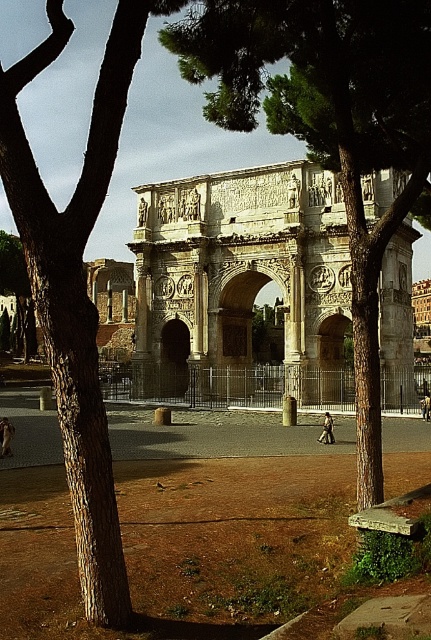
Question: Can you confirm if green leafy tree at center is thinner than brown rough tree at left?

Choices:
 (A) no
 (B) yes

Answer: (B)

Question: Is green leafy tree at center to the left of brown rough tree at left from the viewer's perspective?

Choices:
 (A) no
 (B) yes

Answer: (A)

Question: In this image, where is green leafy tree at center located relative to brown rough tree at left?

Choices:
 (A) below
 (B) above

Answer: (A)

Question: Which point appears farthest from the camera in this image?

Choices:
 (A) (349, 212)
 (B) (88, 458)

Answer: (A)

Question: Which point is closer to the camera?

Choices:
 (A) green leafy tree at center
 (B) brown rough tree at left

Answer: (B)